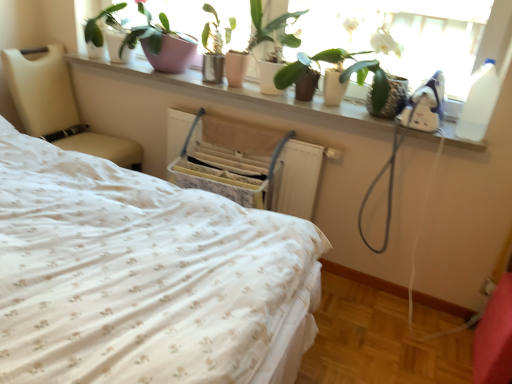
Question: From the image's perspective, would you say green matte plant at upper center, acting as the second houseplant starting from the left, is positioned over white floral fabric bed at center?

Choices:
 (A) no
 (B) yes

Answer: (B)

Question: Does green matte plant at upper center, arranged as the 1th houseplant when viewed from the right, have a lesser height compared to white floral fabric bed at center?

Choices:
 (A) yes
 (B) no

Answer: (A)

Question: Can you confirm if green matte plant at upper center, acting as the second houseplant starting from the left, is smaller than white floral fabric bed at center?

Choices:
 (A) no
 (B) yes

Answer: (B)

Question: Can you confirm if green matte plant at upper center, acting as the second houseplant starting from the left, is wider than white floral fabric bed at center?

Choices:
 (A) yes
 (B) no

Answer: (B)

Question: Is green matte plant at upper center, arranged as the 1th houseplant when viewed from the right, far from white floral fabric bed at center?

Choices:
 (A) no
 (B) yes

Answer: (B)

Question: Would you say white floral fabric bed at center is part of green matte plant at upper center, arranged as the 1th houseplant when viewed from the right,'s contents?

Choices:
 (A) no
 (B) yes

Answer: (A)

Question: From a real-world perspective, is pink ceramic pot at upper center, which is counted as the first houseplant, starting from the left, located higher than beige leather chair at left?

Choices:
 (A) yes
 (B) no

Answer: (A)

Question: Are pink ceramic pot at upper center, which is counted as the first houseplant, starting from the left, and beige leather chair at left located far from each other?

Choices:
 (A) yes
 (B) no

Answer: (B)

Question: Considering the relative sizes of pink ceramic pot at upper center, acting as the second houseplant starting from the right, and beige leather chair at left in the image provided, is pink ceramic pot at upper center, acting as the second houseplant starting from the right, thinner than beige leather chair at left?

Choices:
 (A) no
 (B) yes

Answer: (B)

Question: Is pink ceramic pot at upper center, which is counted as the first houseplant, starting from the left, in contact with beige leather chair at left?

Choices:
 (A) no
 (B) yes

Answer: (A)

Question: From the image's perspective, is pink ceramic pot at upper center, acting as the second houseplant starting from the right, below beige leather chair at left?

Choices:
 (A) no
 (B) yes

Answer: (A)

Question: Considering the relative sizes of pink ceramic pot at upper center, acting as the second houseplant starting from the right, and beige leather chair at left in the image provided, is pink ceramic pot at upper center, acting as the second houseplant starting from the right, smaller than beige leather chair at left?

Choices:
 (A) no
 (B) yes

Answer: (B)

Question: From the image's perspective, is beige leather chair at left located beneath pink ceramic pot at upper center, which is counted as the first houseplant, starting from the left?

Choices:
 (A) yes
 (B) no

Answer: (A)